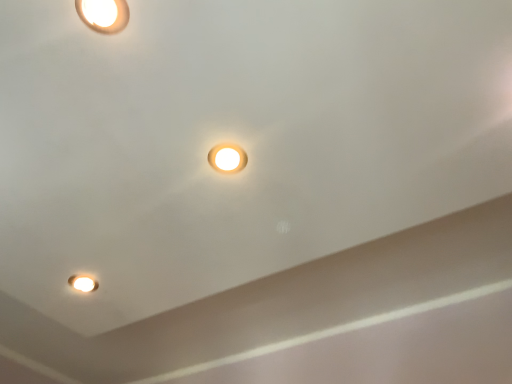
Question: Is matte white light fixture at lower left spatially inside matte white lamp at upper left, acting as the 2th lamp starting from the right, or outside of it?

Choices:
 (A) inside
 (B) outside

Answer: (B)

Question: Relative to matte white lamp at upper left, which appears as the second lamp when ordered from the bottom, is matte white light fixture at lower left in front or behind?

Choices:
 (A) behind
 (B) front

Answer: (A)

Question: Considering the real-world distances, which object is farthest from the matte white lamp at center, the second lamp positioned from the front?

Choices:
 (A) matte white light fixture at lower left
 (B) matte white lamp at upper left, which appears as the second lamp when ordered from the bottom

Answer: (A)

Question: Based on their relative distances, which object is farther from the matte white lamp at upper left, acting as the 2th lamp starting from the right?

Choices:
 (A) matte white lamp at center, arranged as the 1th lamp when viewed from the right
 (B) matte white light fixture at lower left

Answer: (B)